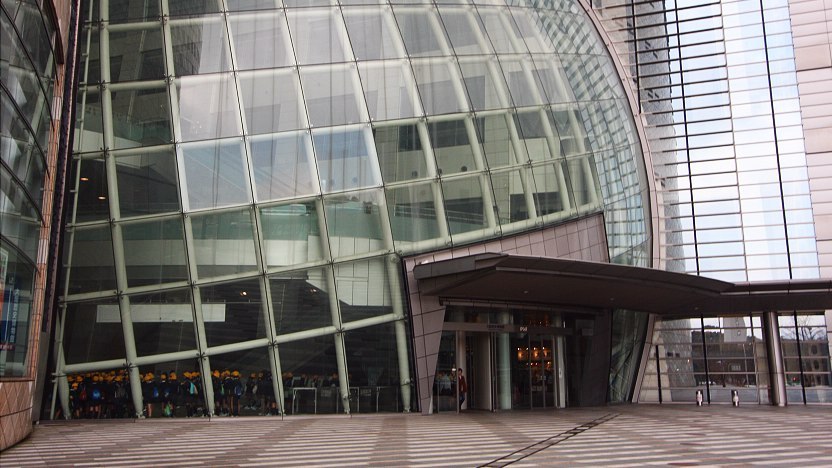
Identify the location of white bricks on floor. (603, 448).